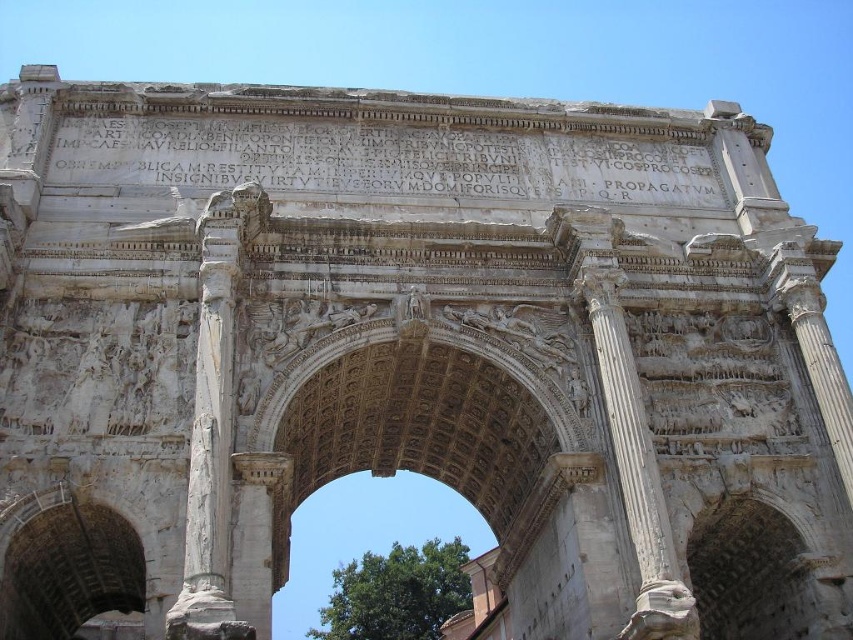
Who is more distant from viewer, (x=236, y=628) or (x=657, y=582)?

Point (x=657, y=582)

Describe the element at coordinates (212, 438) in the screenshot. I see `white marble column at left` at that location.

Measure the distance between point (213, 356) and camera.

Point (213, 356) is 50.92 meters away from camera.

The image size is (853, 640). What are the coordinates of `white marble column at left` in the screenshot? It's located at (212, 438).